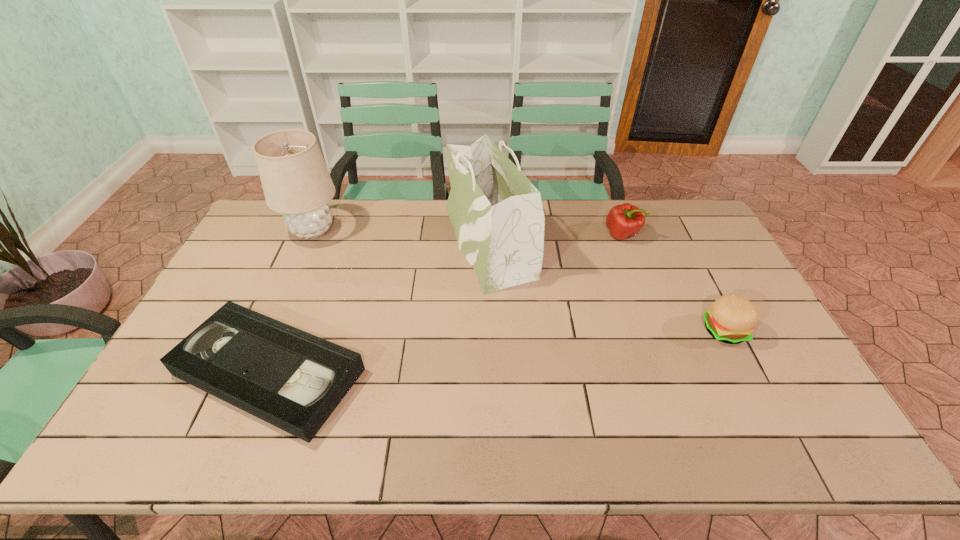
Locate an element on the screen. This screenshot has width=960, height=540. vacant space at the near edge of the desktop is located at coordinates 564,454.

Identify the location of free space at the left edge. This screenshot has width=960, height=540. (182, 417).

At what (x,y) coordinates should I click in order to perform the action: click on free space that is in between the second object from right to left and the videotape. Please return your answer as a coordinate pair (x, y). Looking at the image, I should click on (445, 303).

Image resolution: width=960 pixels, height=540 pixels. I want to click on free spot between the second object from right to left and the hamburger, so click(x=673, y=282).

Identify the location of free point between the videotape and the hamburger. Image resolution: width=960 pixels, height=540 pixels. (496, 351).

Where is `free area in between the third object from left to right and the lampshade`? free area in between the third object from left to right and the lampshade is located at coordinates (400, 236).

Find the location of `free space between the shortest object and the rightmost object`. free space between the shortest object and the rightmost object is located at coordinates (496, 351).

I want to click on free spot between the shortest object and the lampshade, so click(x=291, y=301).

What are the coordinates of `object that is the second closest one to the shortest object` in the screenshot? It's located at (296, 182).

Locate which object is the third closest to the third object from left to right. Please provide its 2D coordinates. Your answer should be formatted as a tuple, i.e. [(x, y)], where the tuple contains the x and y coordinates of a point satisfying the conditions above.

[(296, 182)]